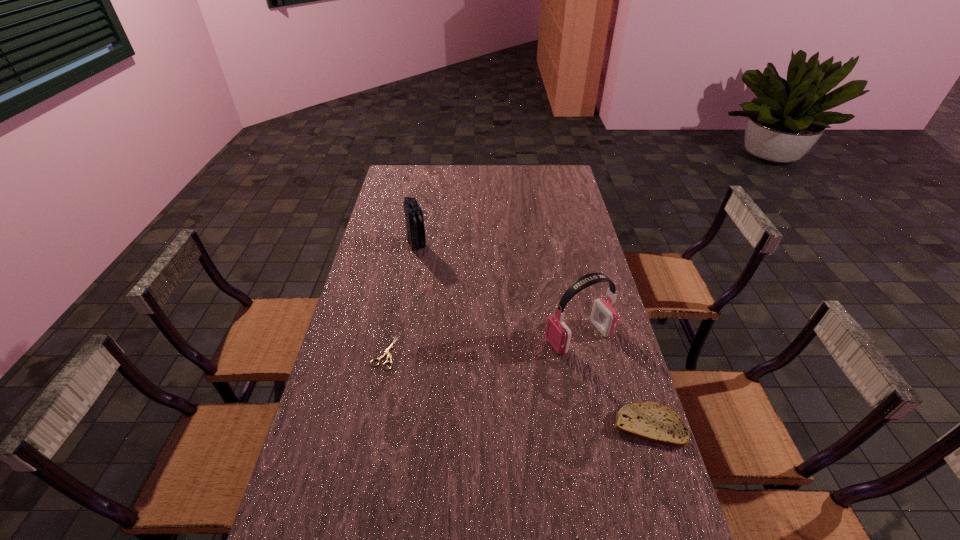
At what (x,y) coordinates should I click in order to perform the action: click on empty location between the tallest object and the third shortest object. Please return your answer as a coordinate pair (x, y). Looking at the image, I should click on (498, 291).

You are a GUI agent. You are given a task and a screenshot of the screen. Output one action in this format:
    pyautogui.click(x=<x>, y=<y>)
    Task: Click on the object that stands as the closest to the earphone
    The image size is (960, 540).
    Given the screenshot: What is the action you would take?
    pyautogui.click(x=648, y=421)

Identify which object is the second nearest to the pita bread. Please provide its 2D coordinates. Your answer should be formatted as a tuple, i.e. [(x, y)], where the tuple contains the x and y coordinates of a point satisfying the conditions above.

[(387, 352)]

The width and height of the screenshot is (960, 540). In order to click on vacant space that satisfies the following two spatial constraints: 1. on the back side of the shears; 2. on the left side of the tallest object in this screenshot , I will do `click(388, 337)`.